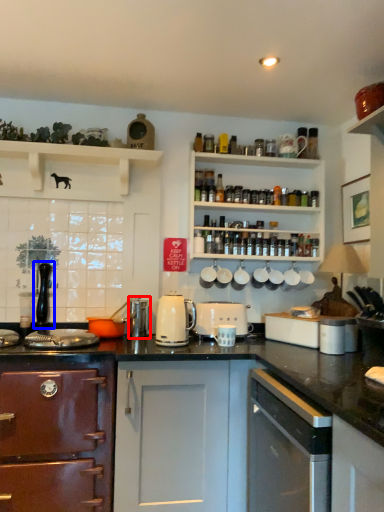
Question: Which object is further to the camera taking this photo, appliance (highlighted by a red box) or faucet (highlighted by a blue box)?

Choices:
 (A) appliance
 (B) faucet

Answer: (B)